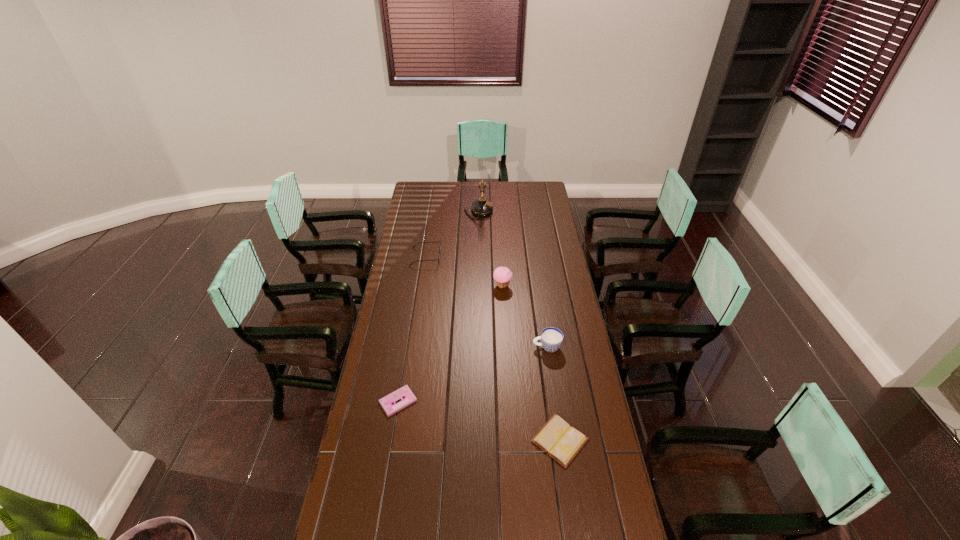
You are a GUI agent. You are given a task and a screenshot of the screen. Output one action in this format:
    pyautogui.click(x=<x>, y=<y>)
    Task: Click on the vacant area that lies between the videotape and the fifth shortest object
    
    Given the screenshot: What is the action you would take?
    pyautogui.click(x=450, y=343)

The image size is (960, 540). What are the coordinates of `vacant space in between the shortest object and the second shortest object` in the screenshot? It's located at (479, 421).

I want to click on unoccupied area between the diary and the fifth nearest object, so click(492, 349).

You are a GUI agent. You are given a task and a screenshot of the screen. Output one action in this format:
    pyautogui.click(x=<x>, y=<y>)
    Task: Click on the free spot between the shortest object and the fourth shortest object
    
    Given the screenshot: What is the action you would take?
    pyautogui.click(x=472, y=374)

You are a GUI agent. You are given a task and a screenshot of the screen. Output one action in this format:
    pyautogui.click(x=<x>, y=<y>)
    Task: Click on the empty location between the shortest object and the diary
    The width and height of the screenshot is (960, 540).
    Given the screenshot: What is the action you would take?
    pyautogui.click(x=479, y=421)

I want to click on free spot between the fifth tallest object and the farthest object, so pyautogui.click(x=519, y=326).

Identify which object is located as the nearest to the telephone. Please provide its 2D coordinates. Your answer should be formatted as a tuple, i.e. [(x, y)], where the tuple contains the x and y coordinates of a point satisfying the conditions above.

[(439, 241)]

The width and height of the screenshot is (960, 540). I want to click on object identified as the closest to the tallest object, so click(439, 241).

Where is `vacant space that satisfies the following two spatial constraints: 1. on the front-facing side of the spectacles; 2. on the back side of the cupcake`? The height and width of the screenshot is (540, 960). vacant space that satisfies the following two spatial constraints: 1. on the front-facing side of the spectacles; 2. on the back side of the cupcake is located at coordinates (421, 286).

What are the coordinates of `vacant area in the image that satisfies the following two spatial constraints: 1. on the front side of the shortest object; 2. on the left side of the second shortest object` in the screenshot? It's located at pos(392,440).